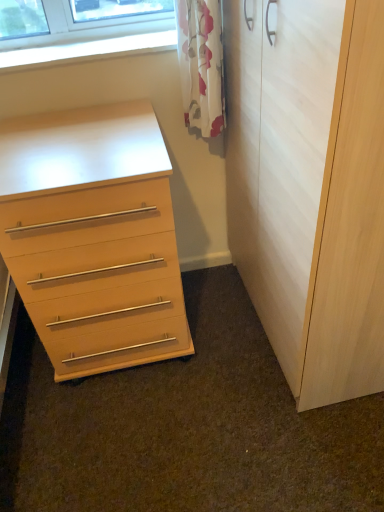
Find the location of a particular element. This screenshot has width=384, height=512. free spot in front of light wood/finish chest of drawers at left is located at coordinates (130, 435).